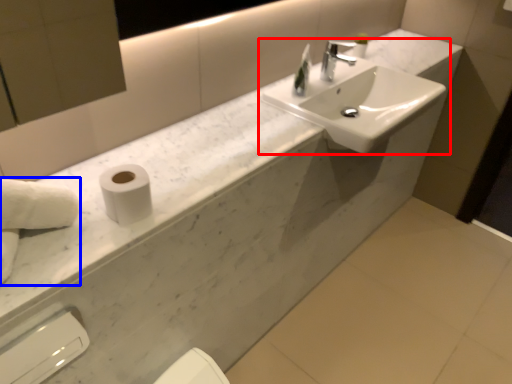
Question: Among these objects, which one is nearest to the camera, sink (highlighted by a red box) or hand towel (highlighted by a blue box)?

Choices:
 (A) sink
 (B) hand towel

Answer: (B)